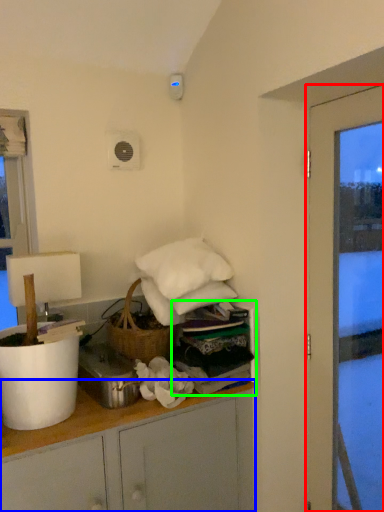
Question: Which object is the farthest from door (highlighted by a red box)? Choose among these: cabinetry (highlighted by a blue box) or shelf (highlighted by a green box).

Choices:
 (A) cabinetry
 (B) shelf

Answer: (A)